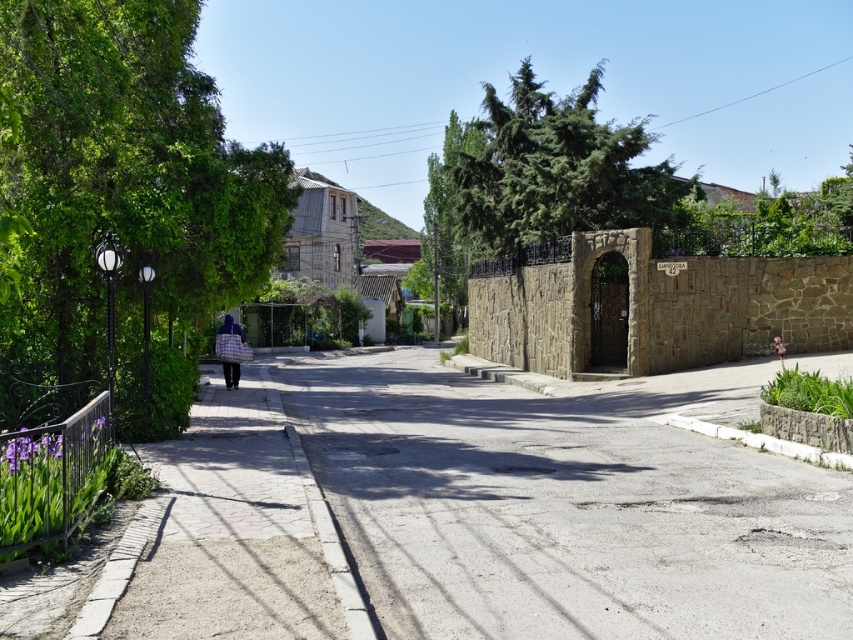
You are a delivery person who needs to place a blue plaid bag at center on the sidewalk. The green leafy tree at left is in the way. Can you move the bag around the tree without bending it?

The green leafy tree at left is taller than the blue plaid bag at center, so you can move the bag around the tree without bending it since the tree is taller and likely has a larger base to navigate around.